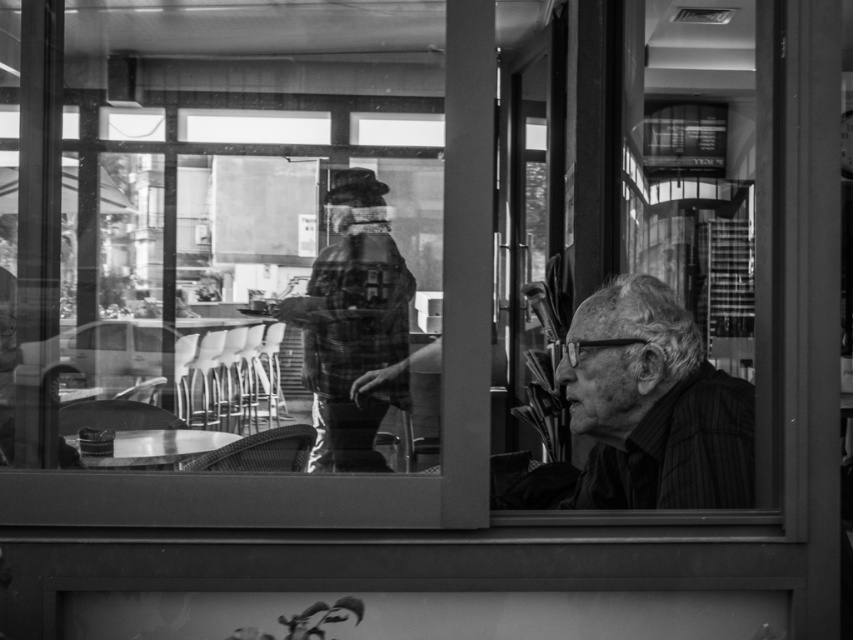
You are trying to decide whether to place a rectangular box between the smooth black shirt at right and the metallic table at lower left. The box is 2 inches thick. Can the space between them accommodate the box?

The smooth black shirt at right is thinner than the metallic table at lower left, but the exact thickness difference isn not provided. However, since the box is only 2 inches thick, it might fit if the space between them is at least 2 inches. Without precise measurements, it is uncertain.

Consider the image. You are a customer in the cafe and want to place your coffee mug on the metallic table at lower left. However, there is a person wearing a smooth black shirt at right in the way. Can you place the mug there without moving the person?

The smooth black shirt at right is positioned over the metallic table at lower left, so the person is blocking access to the table. You cannot place the mug there without moving the person.

You are a customer in the cafe and want to choose a seat between the smooth black shirt at right and the plaid fabric jacket at center. Which seat is more spacious?

The plaid fabric jacket at center occupies more space than the smooth black shirt at right, so the seat near the plaid fabric jacket at center is more spacious.